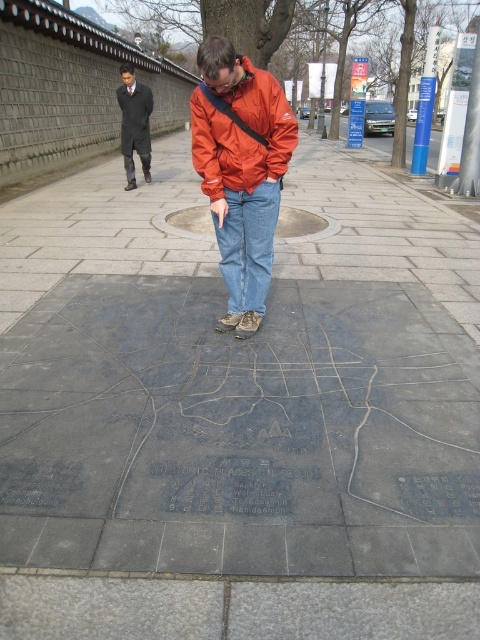
Between orange matte jacket at center and denim at center, which one is positioned higher?

Positioned higher is orange matte jacket at center.

Who is more distant from viewer, [264,84] or [273,212]?

The point [273,212] is behind.

The height and width of the screenshot is (640, 480). Identify the location of orange matte jacket at center. (241, 132).

This screenshot has width=480, height=640. What are the coordinates of `orange matte jacket at center` in the screenshot? It's located at (241, 132).

Which is above, orange nylon jacket at center or orange matte jacket at center?

orange matte jacket at center is higher up.

Which is behind, point (223, 186) or point (259, 157)?

Point (223, 186)

Find the location of `orange nylon jacket at center`. orange nylon jacket at center is located at coordinates (240, 170).

Identify the location of orange nylon jacket at center. (240, 170).

How much distance is there between denim at center and dark gray coat at upper left?

denim at center is 20.35 feet away from dark gray coat at upper left.

Does denim at center have a greater height compared to dark gray coat at upper left?

No.

This screenshot has height=640, width=480. I want to click on denim at center, so click(248, 244).